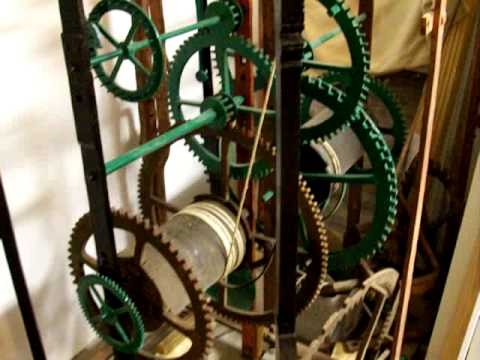
Identify the location of wall. (30, 103).